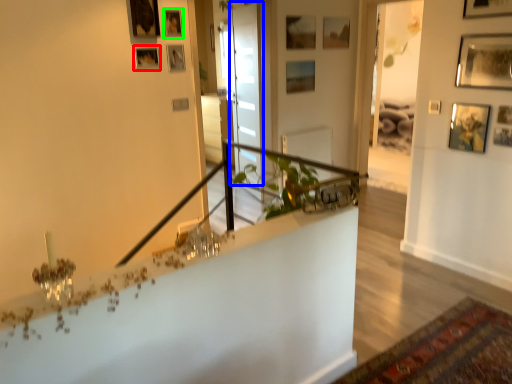
Question: Which object is positioned closest to picture frame (highlighted by a red box)? Select from glass door (highlighted by a blue box) and picture frame (highlighted by a green box).

Choices:
 (A) glass door
 (B) picture frame

Answer: (B)